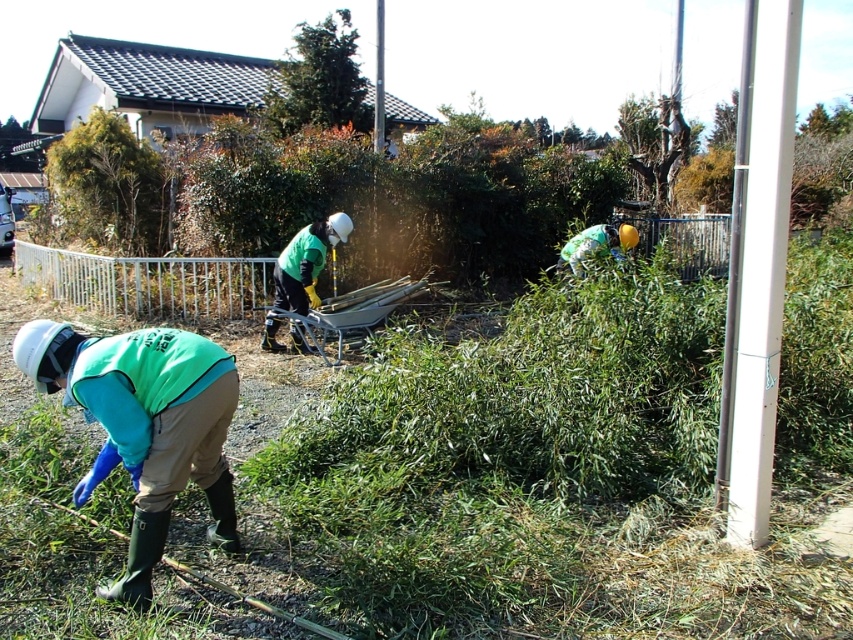
Question: Which point appears closest to the camera in this image?

Choices:
 (A) [202, 442]
 (B) [589, 234]

Answer: (A)

Question: Which object appears farthest from the camera in this image?

Choices:
 (A) green fabric jacket at center
 (B) green fabric shirt at upper center
 (C) green matte jacket at lower left

Answer: (B)

Question: Is green fabric jacket at center above green fabric shirt at upper center?

Choices:
 (A) no
 (B) yes

Answer: (A)

Question: Which object appears farthest from the camera in this image?

Choices:
 (A) green matte jacket at lower left
 (B) green fabric shirt at upper center
 (C) green fabric jacket at center

Answer: (B)

Question: Considering the relative positions of green matte jacket at lower left and green fabric shirt at upper center in the image provided, where is green matte jacket at lower left located with respect to green fabric shirt at upper center?

Choices:
 (A) below
 (B) above

Answer: (A)

Question: Is green fabric jacket at center closer to the viewer compared to green fabric shirt at upper center?

Choices:
 (A) no
 (B) yes

Answer: (B)